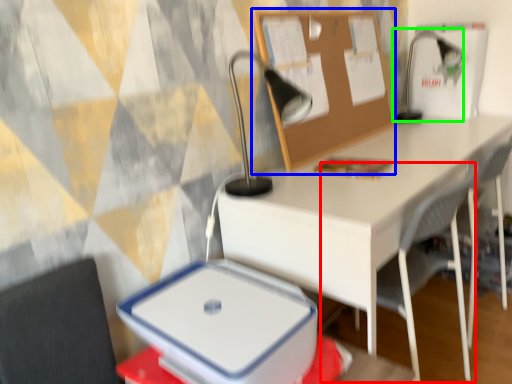
Question: Estimate the real-world distances between objects in this image. Which object is farther from armchair (highlighted by a red box), bulletin board (highlighted by a blue box) or table lamp (highlighted by a green box)?

Choices:
 (A) bulletin board
 (B) table lamp

Answer: (B)